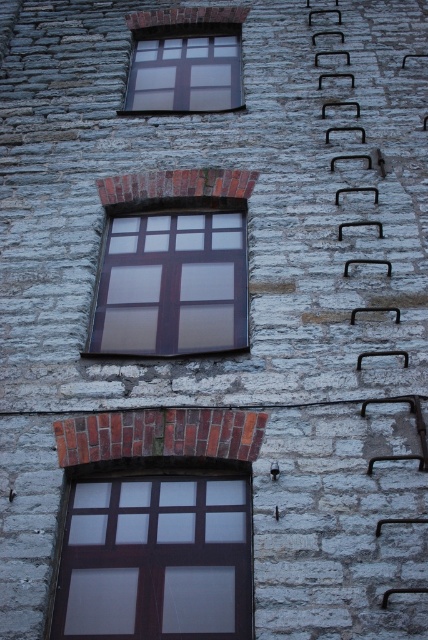
You are standing in front of the stone building and want to touch one of the windows. Which window, the matte brown window at lower center or the matte glass window at upper center, is physically closer to you?

The matte brown window at lower center is closer to the viewer than the matte glass window at upper center, so you can touch it first without moving further forward.

You are standing in front of a stone building with three windows. You notice a point marked at coordinates (x=155, y=557). Which object is located at that point?

The point at (x=155, y=557) is where the matte brown window at lower center is located.